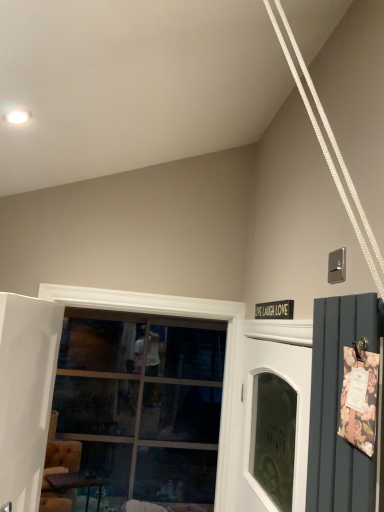
Question: Can you confirm if white glass door at center is positioned to the right of wooden table at lower left?

Choices:
 (A) no
 (B) yes

Answer: (B)

Question: Would you consider white glass door at center to be distant from wooden table at lower left?

Choices:
 (A) yes
 (B) no

Answer: (A)

Question: Considering the relative sizes of white glass door at center and wooden table at lower left in the image provided, is white glass door at center smaller than wooden table at lower left?

Choices:
 (A) yes
 (B) no

Answer: (B)

Question: Is white glass door at center positioned with its back to wooden table at lower left?

Choices:
 (A) yes
 (B) no

Answer: (B)

Question: Is white glass door at center further to the viewer compared to wooden table at lower left?

Choices:
 (A) no
 (B) yes

Answer: (A)

Question: From the image's perspective, is clear glass window at center positioned above or below white glossy door at left?

Choices:
 (A) below
 (B) above

Answer: (A)

Question: In the image, is clear glass window at center positioned in front of or behind white glossy door at left?

Choices:
 (A) front
 (B) behind

Answer: (B)

Question: Based on their positions, is clear glass window at center located to the left or right of white glossy door at left?

Choices:
 (A) left
 (B) right

Answer: (B)

Question: From a real-world perspective, is clear glass window at center physically located above or below white glossy door at left?

Choices:
 (A) below
 (B) above

Answer: (B)

Question: From a real-world perspective, relative to clear glass window at center, is white glossy door at left vertically above or below?

Choices:
 (A) below
 (B) above

Answer: (A)

Question: In the image, is white glossy door at left on the left side or the right side of clear glass window at center?

Choices:
 (A) left
 (B) right

Answer: (A)

Question: Considering the positions of white glossy door at left and clear glass window at center in the image, is white glossy door at left wider or thinner than clear glass window at center?

Choices:
 (A) wide
 (B) thin

Answer: (B)

Question: From the image's perspective, is white glossy door at left located above or below clear glass window at center?

Choices:
 (A) above
 (B) below

Answer: (A)

Question: Visually, is clear glass window at center positioned to the left or to the right of white glass door at center?

Choices:
 (A) left
 (B) right

Answer: (A)

Question: In the image, is clear glass window at center positioned in front of or behind white glass door at center?

Choices:
 (A) behind
 (B) front

Answer: (A)